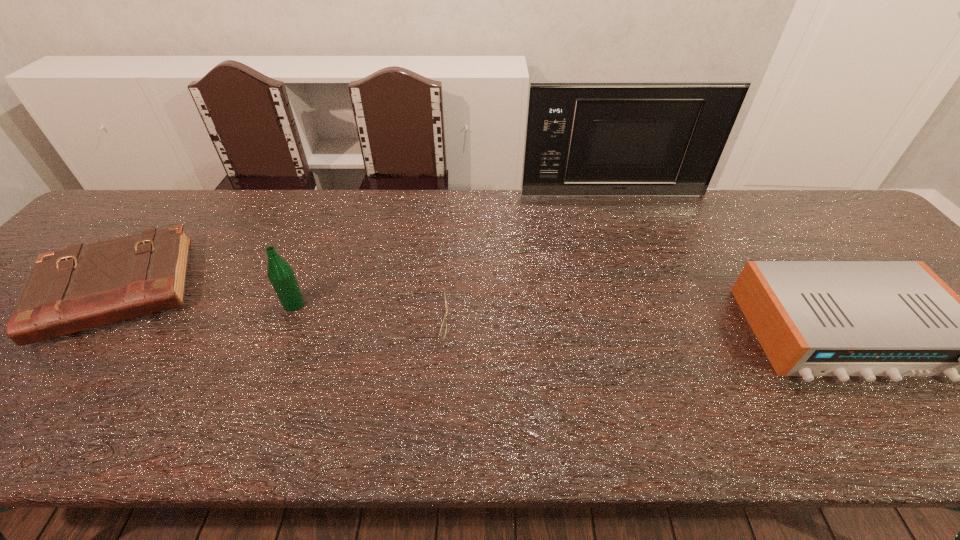
Image resolution: width=960 pixels, height=540 pixels. In order to click on the farthest object in this screenshot , I will do `click(663, 139)`.

In order to click on microwave oven in this screenshot , I will do `click(663, 139)`.

Locate an element on the screen. The image size is (960, 540). the second object from left to right is located at coordinates (280, 273).

The height and width of the screenshot is (540, 960). I want to click on the fourth shortest object, so click(280, 273).

At what (x,y) coordinates should I click in order to perform the action: click on the shortest object. Please return your answer as a coordinate pair (x, y). Looking at the image, I should click on (443, 329).

I want to click on the third object from left to right, so [x=443, y=329].

Image resolution: width=960 pixels, height=540 pixels. Find the location of `free region located 0.190m on the front panel of the microwave oven`. free region located 0.190m on the front panel of the microwave oven is located at coordinates (627, 237).

Locate an element on the screen. This screenshot has width=960, height=540. free space located on the back of the fourth object from right to left is located at coordinates (302, 281).

This screenshot has width=960, height=540. I want to click on vacant space situated 0.050m on the front-facing side of the shortest object, so point(469,321).

You are a GUI agent. You are given a task and a screenshot of the screen. Output one action in this format:
    pyautogui.click(x=<x>, y=<y>)
    Task: Click on the object present at the far edge
    This screenshot has height=540, width=960.
    Given the screenshot: What is the action you would take?
    pyautogui.click(x=663, y=139)